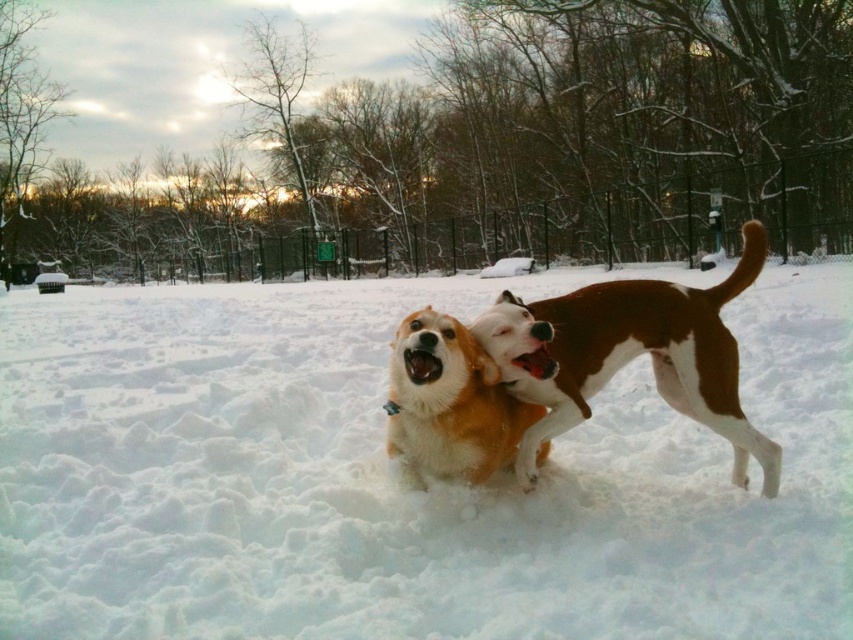
Consider the image. Can you confirm if white fluffy snow at center is wider than soft fur dog at center?

Yes.

Who is higher up, white fluffy snow at center or soft fur dog at center?

white fluffy snow at center is above.

Find the location of a particular element. The height and width of the screenshot is (640, 853). white fluffy snow at center is located at coordinates coord(395,476).

The height and width of the screenshot is (640, 853). Identify the location of white fluffy snow at center. (395, 476).

Who is positioned more to the right, brown/white fur dog at center or soft fur dog at center?

brown/white fur dog at center is more to the right.

Between brown/white fur dog at center and soft fur dog at center, which one has less height?

Standing shorter between the two is soft fur dog at center.

Is point (514, 467) positioned behind point (543, 448)?

That is False.

Identify the location of brown/white fur dog at center. Image resolution: width=853 pixels, height=640 pixels. click(630, 355).

Between white fluffy snow at center and brown/white fur dog at center, which one appears on the right side from the viewer's perspective?

brown/white fur dog at center is more to the right.

Who is positioned more to the left, white fluffy snow at center or brown/white fur dog at center?

white fluffy snow at center is more to the left.

Is point (204, 488) behind point (746, 481)?

No.

The width and height of the screenshot is (853, 640). Find the location of `white fluffy snow at center`. white fluffy snow at center is located at coordinates (395, 476).